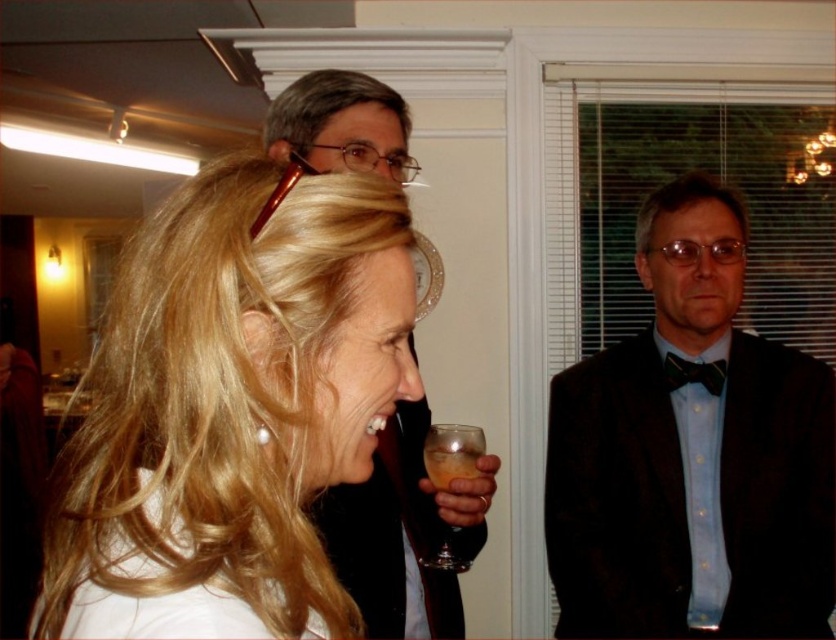
Question: Which of the following is the closest to the observer?

Choices:
 (A) tap(473, 428)
 (B) tap(196, 240)

Answer: (B)

Question: From the image, what is the correct spatial relationship of blonde hair at upper left in relation to matte black suit at upper center?

Choices:
 (A) left
 (B) right

Answer: (A)

Question: Is translucent glass at lower center smaller than translucent amber liquid at lower center?

Choices:
 (A) no
 (B) yes

Answer: (A)

Question: Which point is farther to the camera?

Choices:
 (A) [x=320, y=369]
 (B) [x=701, y=381]
 (C) [x=480, y=528]

Answer: (B)

Question: Which object is positioned farthest from the dark blue satin bow tie at right?

Choices:
 (A) multicolored satin bow tie at right
 (B) translucent amber liquid at lower center
 (C) translucent glass at lower center

Answer: (B)

Question: Is matte black suit at upper center to the right of multicolored satin bow tie at right from the viewer's perspective?

Choices:
 (A) yes
 (B) no

Answer: (B)